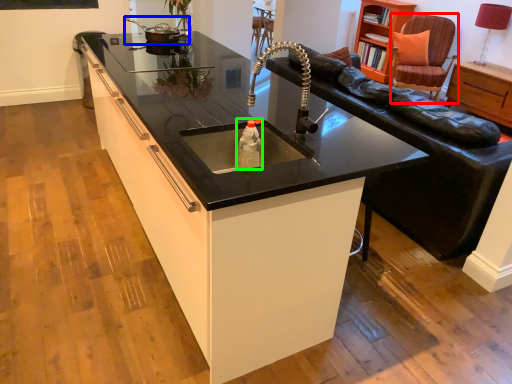
Question: Which object is the closest to the swivel chair (highlighted by a red box)? Choose among these: appliance (highlighted by a blue box) or bottle (highlighted by a green box).

Choices:
 (A) appliance
 (B) bottle

Answer: (A)